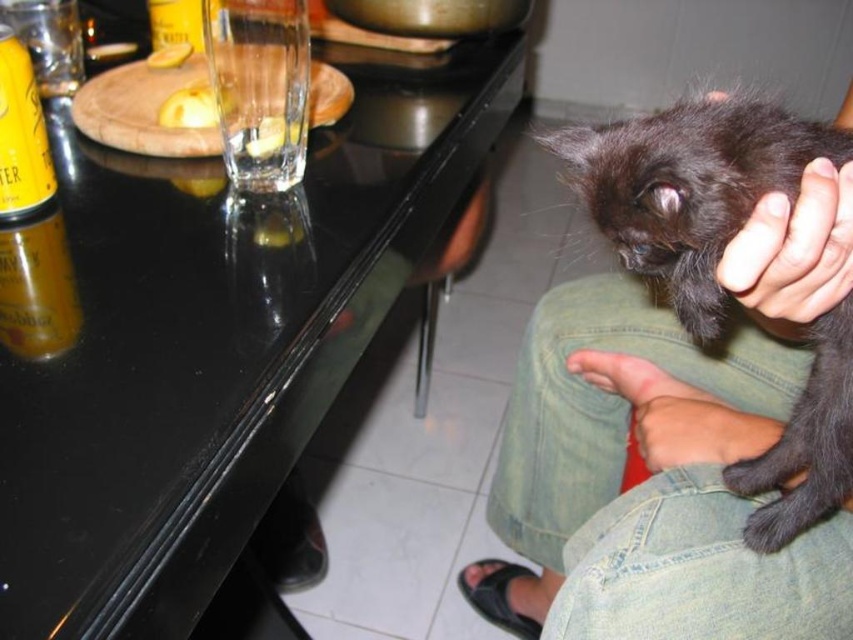
Question: Estimate the real-world distances between objects in this image. Which object is farther from the black matte hand at upper right?

Choices:
 (A) black glossy table at center
 (B) black fluffy cat at upper right
 (C) black furry cat at upper right

Answer: (A)

Question: Is black glossy table at center to the left of smooth skin hand at lower right from the viewer's perspective?

Choices:
 (A) no
 (B) yes

Answer: (B)

Question: Estimate the real-world distances between objects in this image. Which object is farther from the black fluffy cat at upper right?

Choices:
 (A) black glossy table at center
 (B) black furry cat at upper right

Answer: (A)

Question: Which object is farther from the camera taking this photo?

Choices:
 (A) smooth skin hand at lower right
 (B) black furry cat at upper right
 (C) black glossy table at center

Answer: (A)

Question: Observing the image, what is the correct spatial positioning of black furry cat at upper right in reference to black fluffy cat at upper right?

Choices:
 (A) right
 (B) left

Answer: (B)

Question: Can you confirm if black glossy table at center is bigger than black fluffy cat at upper right?

Choices:
 (A) no
 (B) yes

Answer: (B)